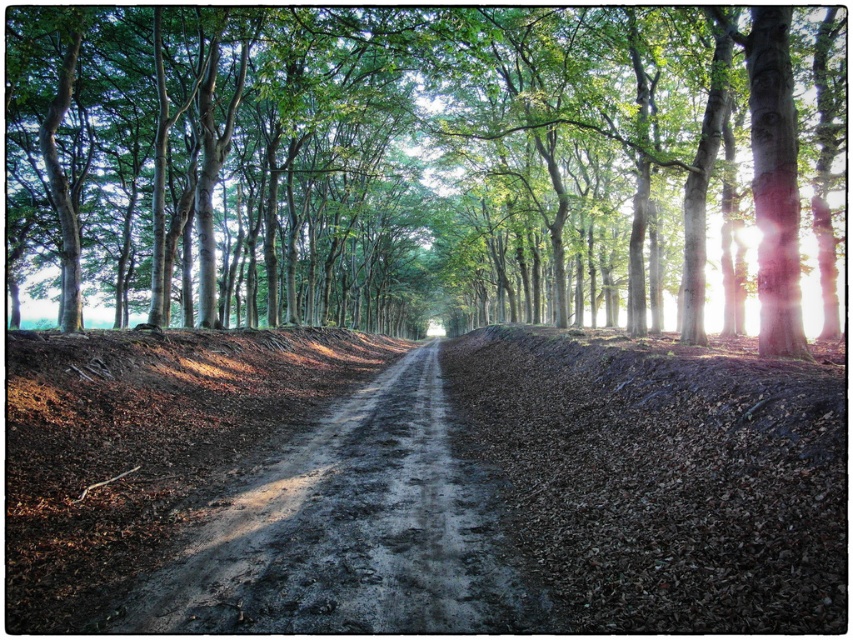
Question: Which object is positioned closest to the green leafy tree at center?

Choices:
 (A) brown/dry mud at center
 (B) dirt/gravel path at center

Answer: (B)

Question: Which point is closer to the camera?

Choices:
 (A) (248, 492)
 (B) (769, 401)

Answer: (B)

Question: Is green leafy tree at center below brown/dry mud at center?

Choices:
 (A) yes
 (B) no

Answer: (B)

Question: Does green leafy tree at center appear over brown/dry mud at center?

Choices:
 (A) no
 (B) yes

Answer: (B)

Question: Based on their relative distances, which object is farther from the brown/dry mud at center?

Choices:
 (A) green leafy tree at center
 (B) dirt/gravel path at center

Answer: (A)

Question: Can you confirm if green leafy tree at center is positioned to the left of dirt/gravel path at center?

Choices:
 (A) no
 (B) yes

Answer: (B)